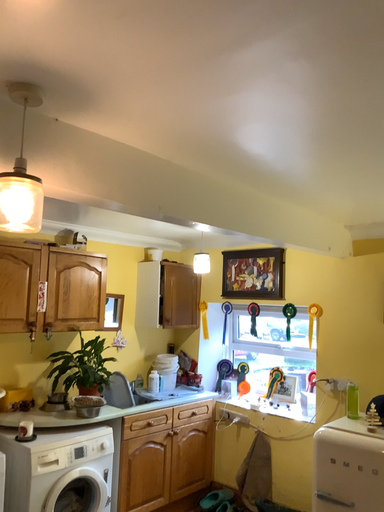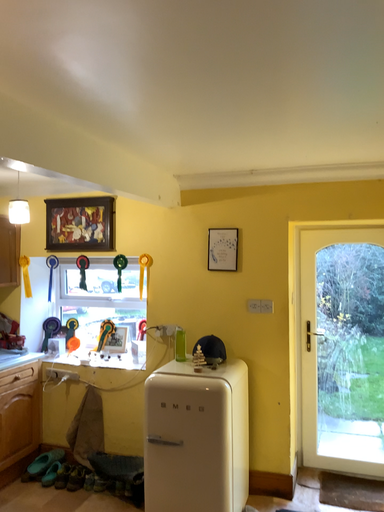
Question: Which way did the camera rotate in the video?

Choices:
 (A) rotated downward
 (B) rotated upward

Answer: (A)